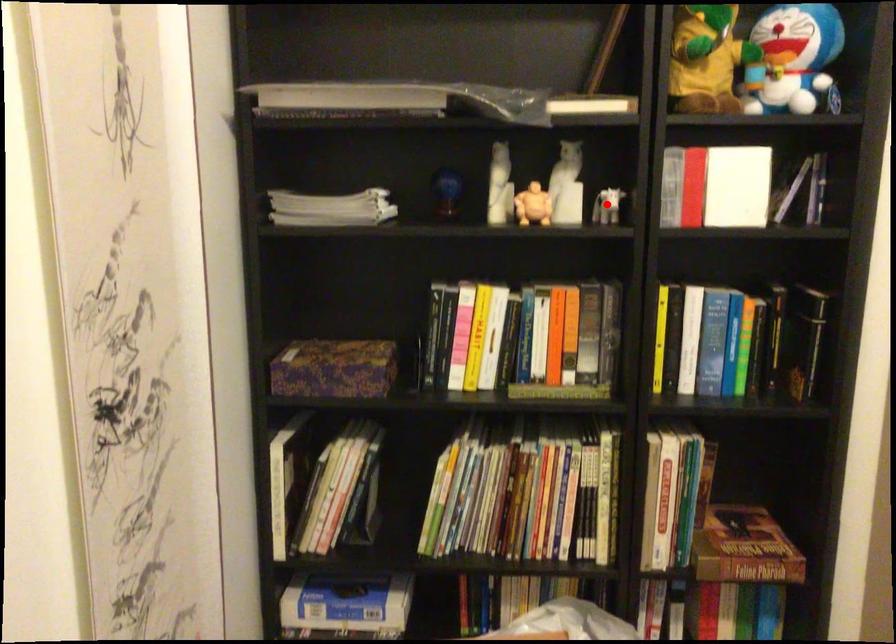
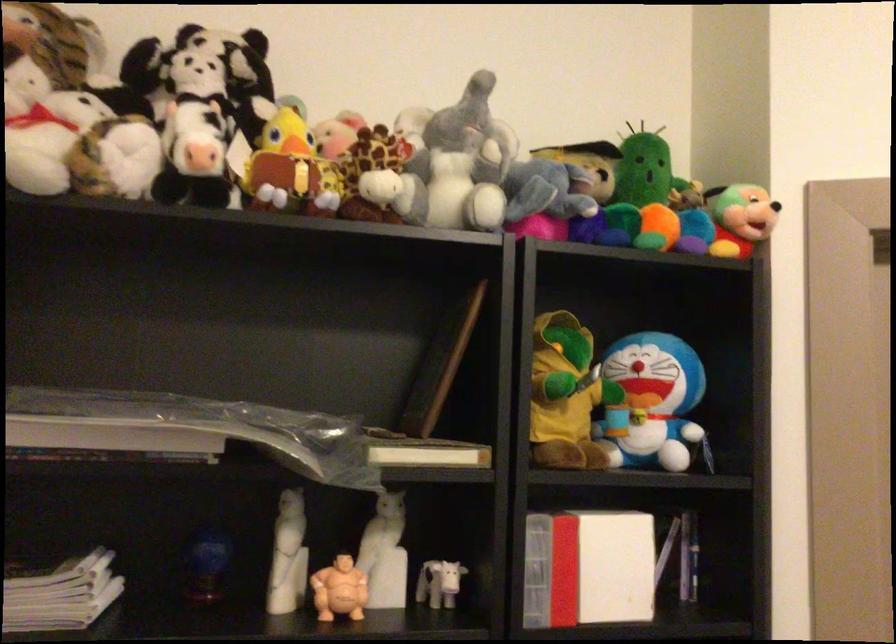
In the second image, find the point that corresponds to the highlighted location in the first image.

(438, 583)